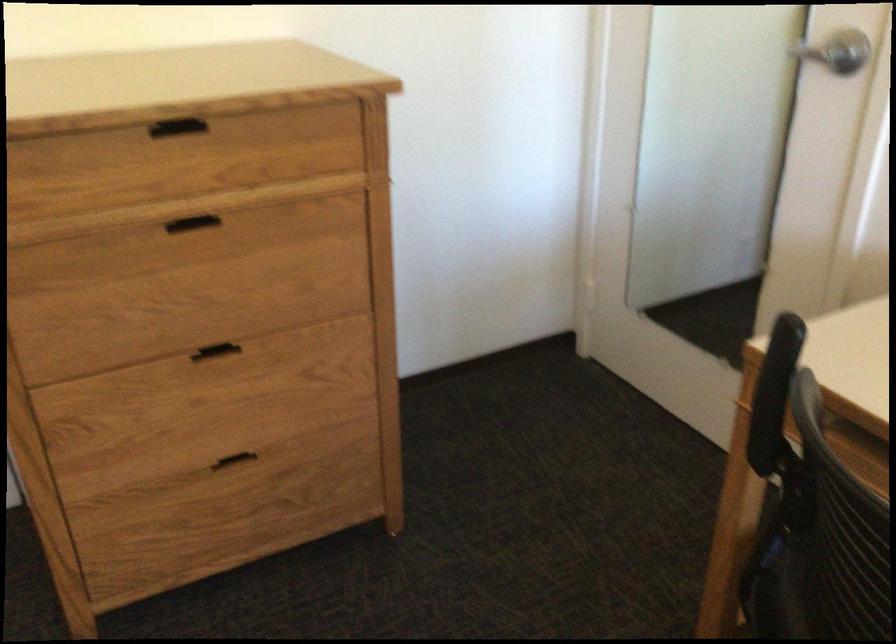
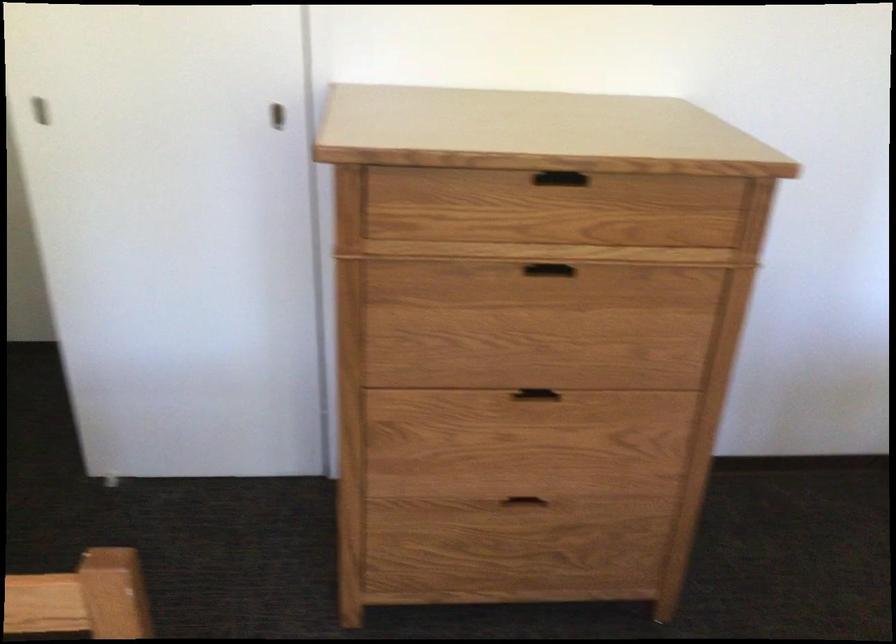
Question: Which direction would the cameraman need to move to produce the second image? Reply with the corresponding letter.

Choices:
 (A) Left
 (B) Right
 (C) Forward
 (D) Backward

Answer: (A)